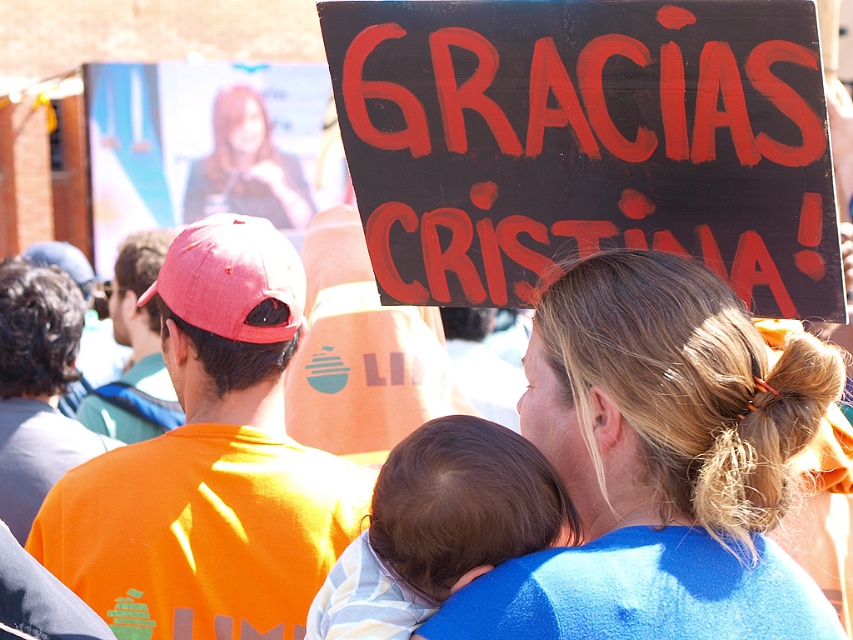
Does blonde hair at upper center come behind soft white fabric at center?

No.

Between blonde hair at upper center and soft white fabric at center, which one has less height?

Standing shorter between the two is soft white fabric at center.

Who is more distant from viewer, (701,522) or (477,522)?

Positioned behind is point (477,522).

Locate an element on the screen. Image resolution: width=853 pixels, height=640 pixels. blonde hair at upper center is located at coordinates (659, 464).